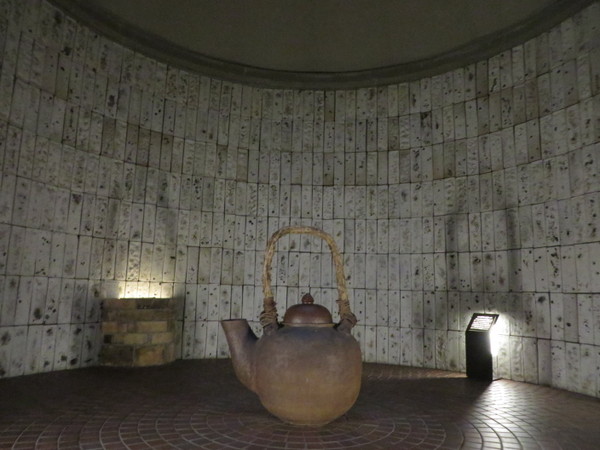
Where is `ceiling around border`? The height and width of the screenshot is (450, 600). ceiling around border is located at coordinates (297, 79).